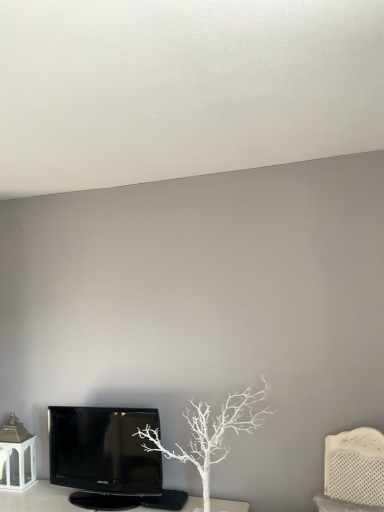
Question: Does black glossy television at lower left have a greater height compared to white textured headboard at right?

Choices:
 (A) yes
 (B) no

Answer: (A)

Question: Could you tell me if black glossy television at lower left is facing white textured headboard at right?

Choices:
 (A) yes
 (B) no

Answer: (B)

Question: Are black glossy television at lower left and white textured headboard at right located far from each other?

Choices:
 (A) no
 (B) yes

Answer: (B)

Question: Would you say white textured headboard at right is part of black glossy television at lower left's contents?

Choices:
 (A) no
 (B) yes

Answer: (A)

Question: Is black glossy television at lower left turned away from white textured headboard at right?

Choices:
 (A) no
 (B) yes

Answer: (A)

Question: From the image's perspective, is black glossy television at lower left beneath white textured headboard at right?

Choices:
 (A) no
 (B) yes

Answer: (A)

Question: Is white textured headboard at right bigger than white matte tree at center?

Choices:
 (A) yes
 (B) no

Answer: (B)

Question: From a real-world perspective, is white textured headboard at right beneath white matte tree at center?

Choices:
 (A) no
 (B) yes

Answer: (B)

Question: Could you tell me if white textured headboard at right is turned towards white matte tree at center?

Choices:
 (A) yes
 (B) no

Answer: (B)

Question: Are white textured headboard at right and white matte tree at center far apart?

Choices:
 (A) yes
 (B) no

Answer: (B)

Question: Is white textured headboard at right positioned beyond the bounds of white matte tree at center?

Choices:
 (A) yes
 (B) no

Answer: (A)

Question: Is white textured headboard at right in contact with white matte tree at center?

Choices:
 (A) yes
 (B) no

Answer: (B)

Question: Is white matte tree at center oriented away from white textured headboard at right?

Choices:
 (A) yes
 (B) no

Answer: (B)